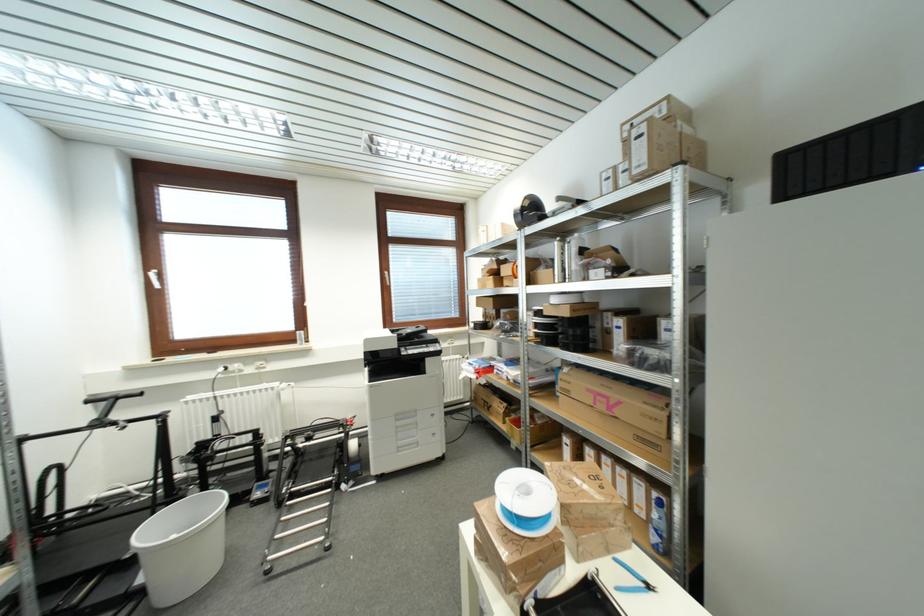
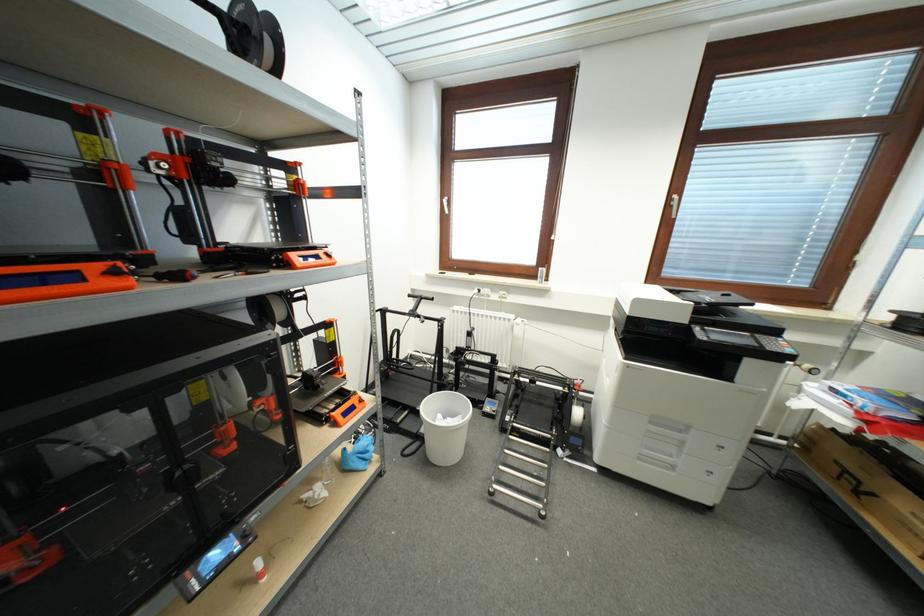
Where in the second image is the point corresponding to (x=144, y=582) from the first image?

(427, 434)